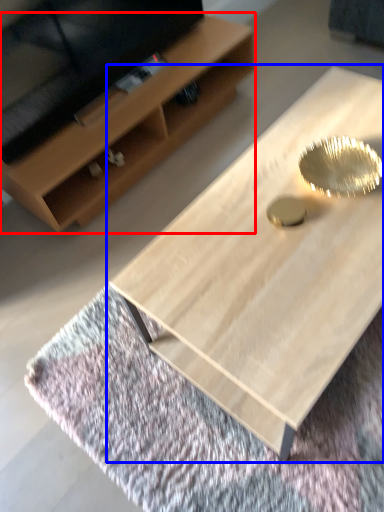
Question: Among these objects, which one is nearest to the camera, shelf (highlighted by a red box) or coffee table (highlighted by a blue box)?

Choices:
 (A) shelf
 (B) coffee table

Answer: (B)